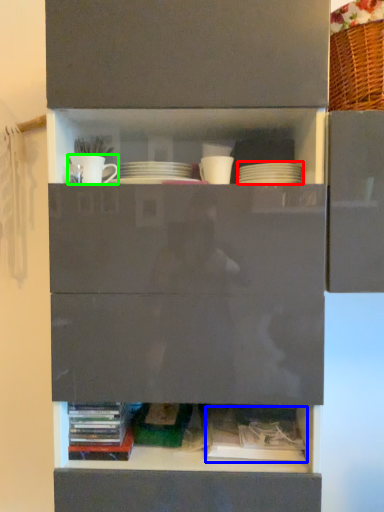
Question: Considering the real-world distances, which object is farthest from tableware (highlighted by a red box)? book (highlighted by a blue box) or tableware (highlighted by a green box)?

Choices:
 (A) book
 (B) tableware

Answer: (A)